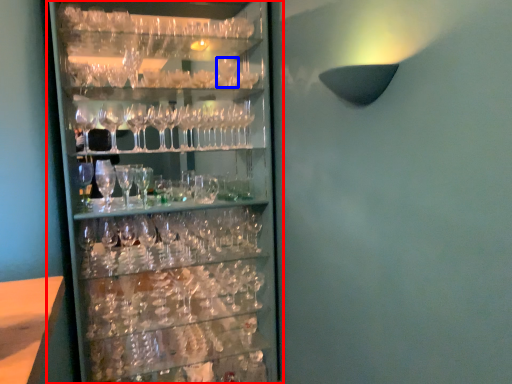
Question: Which point is closer to the camera, shelf (highlighted by a red box) or wine glass (highlighted by a blue box)?

Choices:
 (A) shelf
 (B) wine glass

Answer: (A)